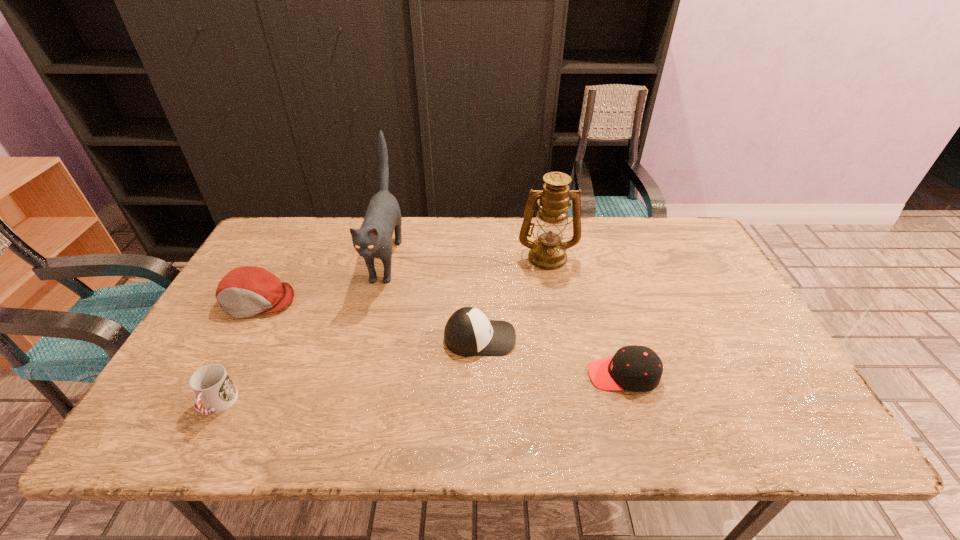
This screenshot has height=540, width=960. I want to click on free spot located on the handle side of the cup, so click(x=197, y=447).

This screenshot has height=540, width=960. Identify the location of vacant area located on the front-facing side of the rightmost cap. point(492,375).

At what (x,y) coordinates should I click in order to perform the action: click on vacant area situated on the front-facing side of the rightmost cap. Please return your answer as a coordinate pair (x, y). Looking at the image, I should click on (525, 375).

Where is `vacant space located on the front-facing side of the rightmost cap`? The image size is (960, 540). vacant space located on the front-facing side of the rightmost cap is located at coordinates (424, 375).

The height and width of the screenshot is (540, 960). I want to click on cat positioned at the far edge, so 383,216.

This screenshot has height=540, width=960. I want to click on oil lamp present at the far edge, so (548, 252).

What are the coordinates of `object present at the near edge` in the screenshot? It's located at pyautogui.click(x=212, y=385).

This screenshot has height=540, width=960. What are the coordinates of `cap situated at the left edge` in the screenshot? It's located at (246, 291).

Where is `cup positioned at the left edge`? cup positioned at the left edge is located at coordinates (212, 385).

Where is `object at the near left corner`? This screenshot has height=540, width=960. object at the near left corner is located at coordinates (212, 385).